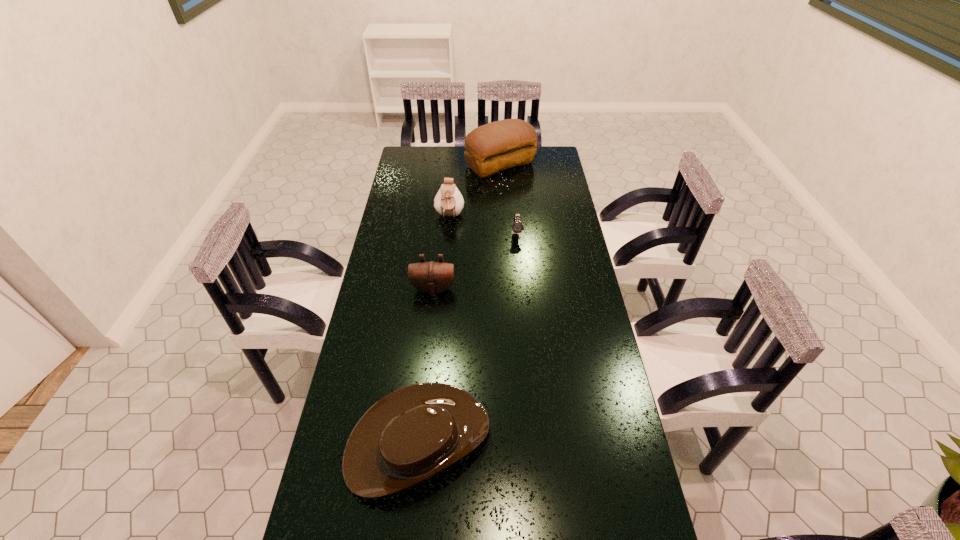
You are a GUI agent. You are given a task and a screenshot of the screen. Output one action in this format:
    pyautogui.click(x=<x>, y=<y>)
    Task: Click on the vacant area located with the flap open on the nearer pouch
    The image size is (960, 540).
    Given the screenshot: What is the action you would take?
    pyautogui.click(x=424, y=377)

Locate an element on the screen. The image size is (960, 540). free region located 0.120m on the face of the third farthest object is located at coordinates (519, 260).

This screenshot has height=540, width=960. I want to click on vacant space located on the back of the nearest object, so click(432, 312).

Where is `object at the far edge`? The height and width of the screenshot is (540, 960). object at the far edge is located at coordinates (496, 146).

Find the location of a particular element. pouch that is positioned at the left edge is located at coordinates (431, 277).

This screenshot has width=960, height=540. In order to click on cowboy hat present at the left edge in this screenshot , I will do `click(412, 434)`.

The image size is (960, 540). Find the location of `object that is at the right edge`. object that is at the right edge is located at coordinates (496, 146).

Locate an element on the screen. This screenshot has width=960, height=540. object at the far right corner is located at coordinates click(x=496, y=146).

You are a GUI agent. You are given a task and a screenshot of the screen. Output one action in this format:
    pyautogui.click(x=<x>, y=<y>)
    Task: Click on the vacant space at the far edge of the desktop
    Image resolution: width=960 pixels, height=540 pixels.
    Given the screenshot: What is the action you would take?
    pyautogui.click(x=460, y=147)

Image resolution: width=960 pixels, height=540 pixels. I want to click on vacant region at the left edge of the desktop, so click(416, 210).